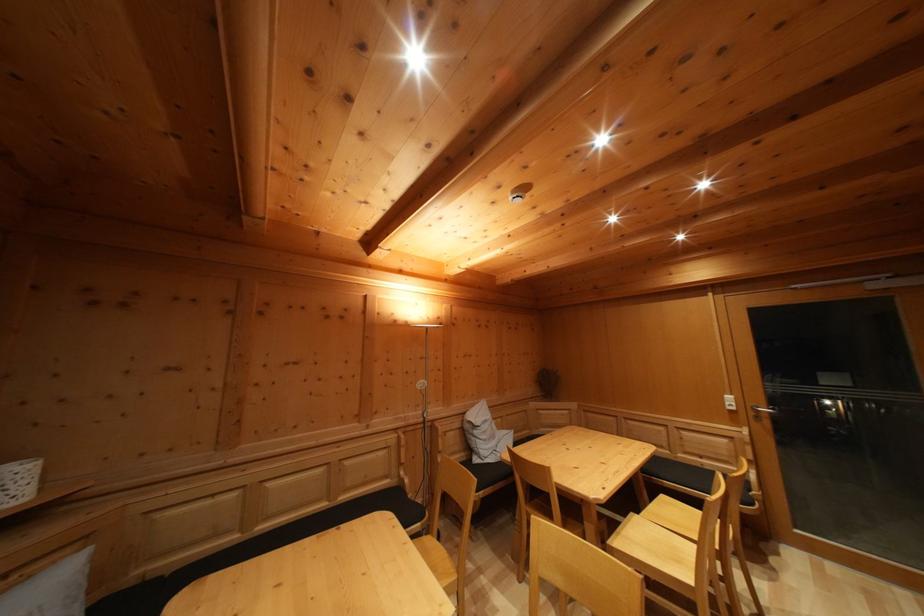
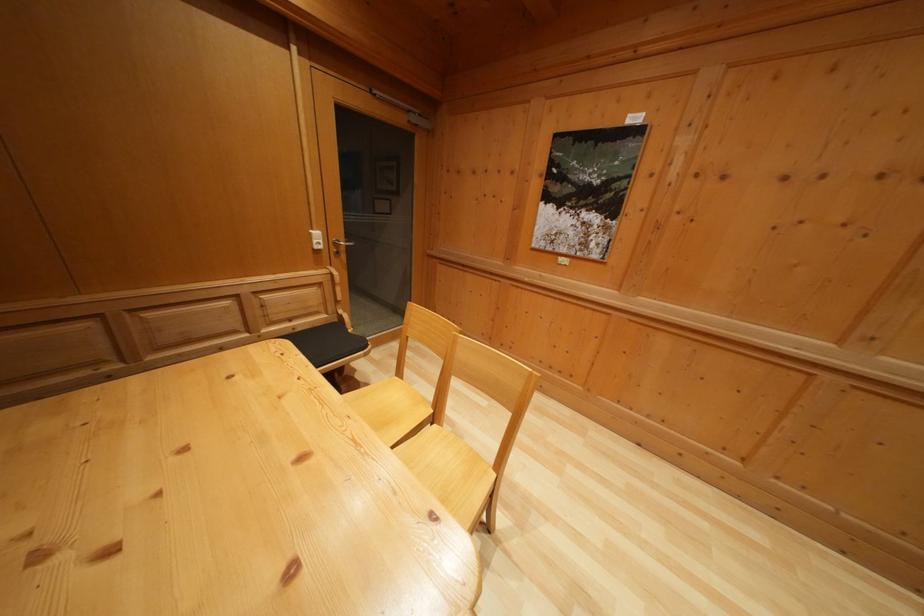
Where in the second image is the point corresponding to (736,405) from the first image?

(322, 240)